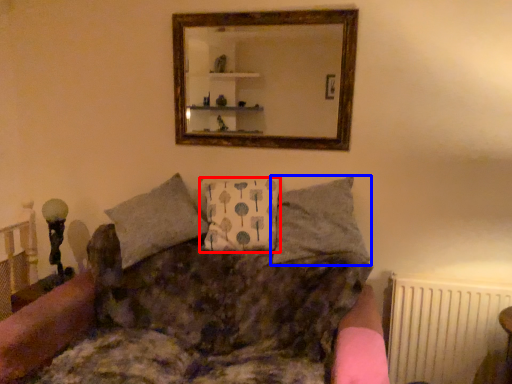
Question: Which of the following is the closest to the observer, pillow (highlighted by a red box) or pillow (highlighted by a blue box)?

Choices:
 (A) pillow
 (B) pillow

Answer: (B)